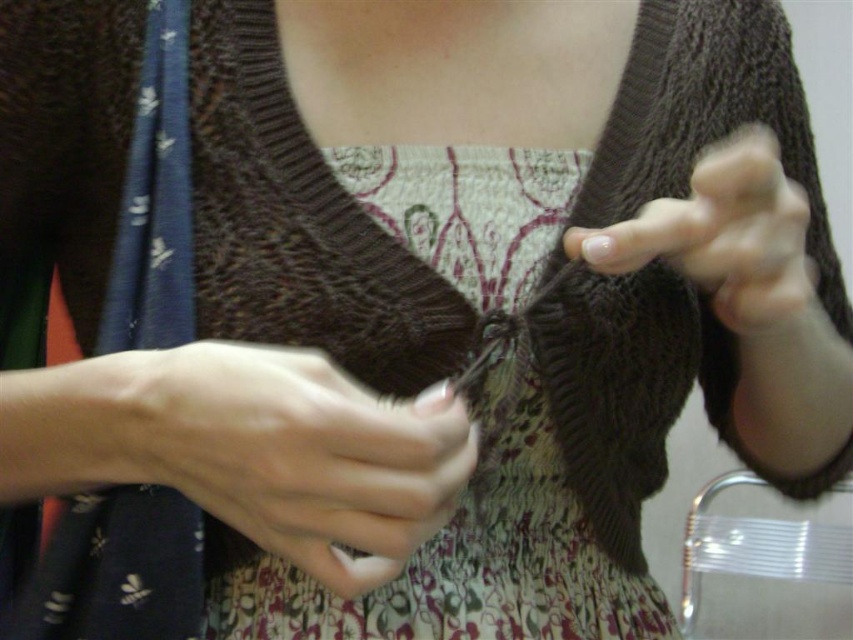
Question: Is white matte skin at center thinner than nail polish at center?

Choices:
 (A) yes
 (B) no

Answer: (A)

Question: Is white matte skin at center bigger than nail polish at center?

Choices:
 (A) no
 (B) yes

Answer: (A)

Question: Considering the relative positions of white matte skin at center and nail polish at center in the image provided, where is white matte skin at center located with respect to nail polish at center?

Choices:
 (A) left
 (B) right

Answer: (A)